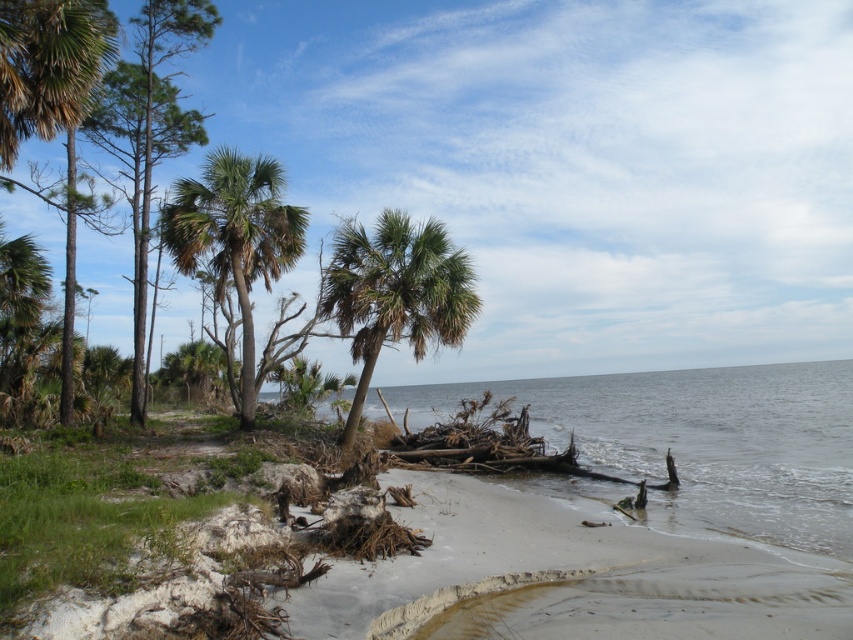
Question: Which of the following is the closest to the observer?

Choices:
 (A) green leafy palm tree at left
 (B) smooth sand beach at lower right
 (C) green leafy palm tree at center

Answer: (B)

Question: Can you confirm if green leafy palm tree at center is positioned below green leafy palm tree at center-left?

Choices:
 (A) yes
 (B) no

Answer: (B)

Question: Which of the following is the farthest from the observer?

Choices:
 (A) (299, 246)
 (B) (374, 256)
 (C) (22, 340)

Answer: (C)

Question: Which object is positioned farthest from the green leafy palm tree at left?

Choices:
 (A) green leafy palm tree at center-left
 (B) green leafy palm tree at center

Answer: (B)

Question: In this image, where is green leafy palm tree at center located relative to green leafy palm tree at left?

Choices:
 (A) right
 (B) left

Answer: (A)

Question: From the image, what is the correct spatial relationship of green leafy palm tree at center in relation to green leafy palm tree at left?

Choices:
 (A) right
 (B) left

Answer: (A)